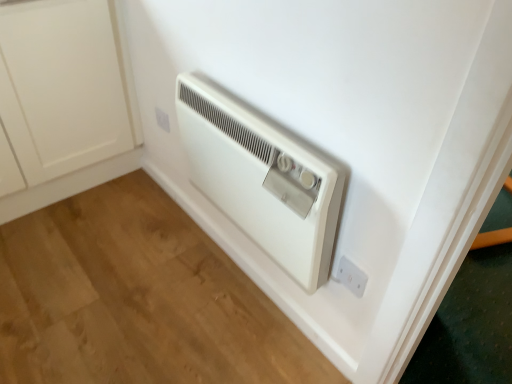
The width and height of the screenshot is (512, 384). Identify the location of vacant area situated below white plastic heater at center (from a real-world perspective). (250, 288).